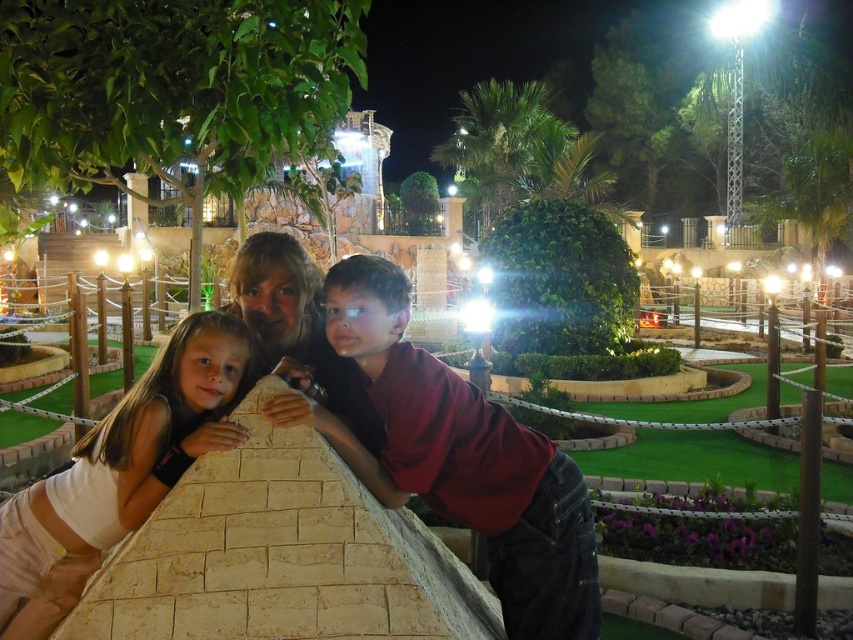
Question: Which object appears farthest from the camera in this image?

Choices:
 (A) maroon fabric shirt at center
 (B) matte red shirt at center
 (C) white matte shirt at center

Answer: (C)

Question: Which point is closer to the camera?

Choices:
 (A) matte red shirt at center
 (B) white matte shirt at center
 (C) maroon fabric shirt at center

Answer: (A)

Question: Can you confirm if maroon fabric shirt at center is positioned to the right of white matte shirt at center?

Choices:
 (A) no
 (B) yes

Answer: (B)

Question: Estimate the real-world distances between objects in this image. Which object is closer to the matte red shirt at center?

Choices:
 (A) white matte shirt at center
 (B) maroon fabric shirt at center

Answer: (B)

Question: Is white matte shirt at center to the left of matte red shirt at center from the viewer's perspective?

Choices:
 (A) no
 (B) yes

Answer: (B)

Question: Where is white matte shirt at center located in relation to matte red shirt at center in the image?

Choices:
 (A) left
 (B) right

Answer: (A)